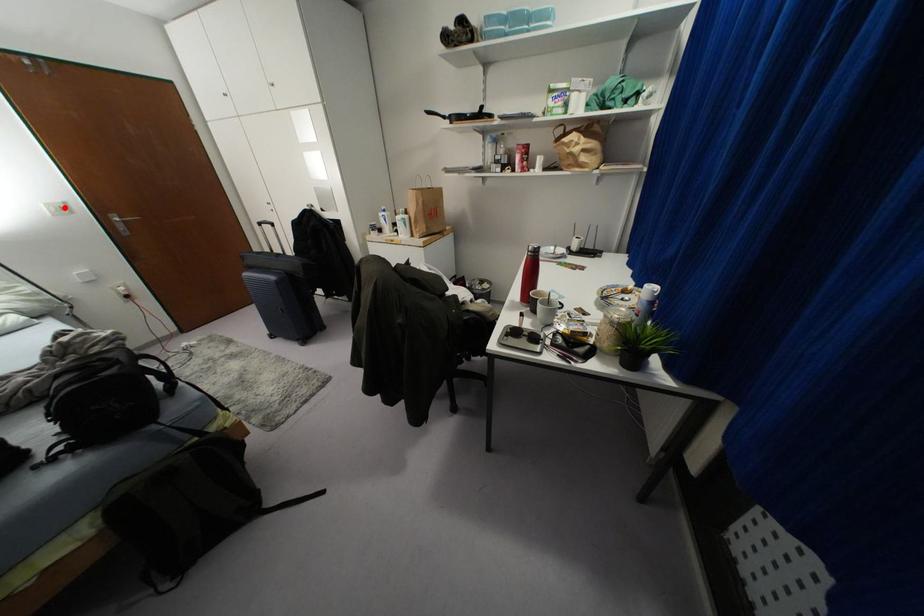
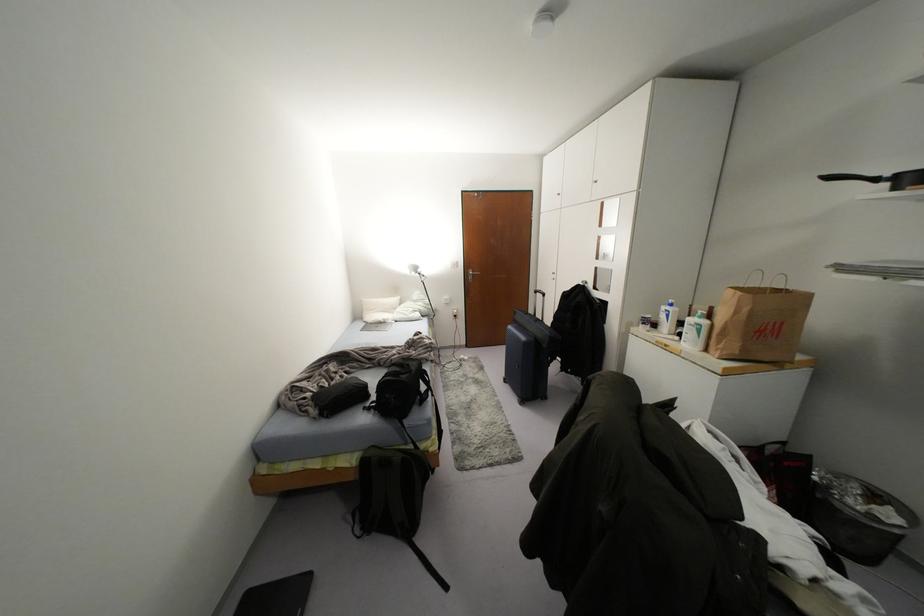
Find the pixel in the second image that matches the highlighted location in the first image.

(456, 264)